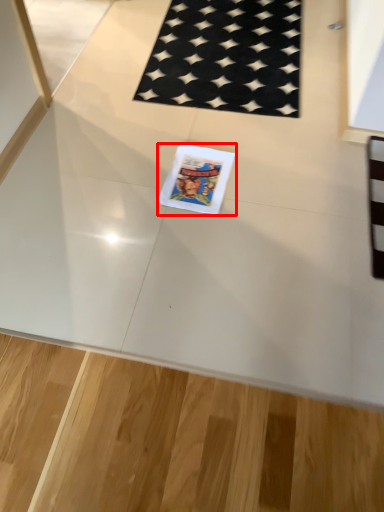
Question: Where is comic book (annotated by the red box) located in relation to mat in the image?

Choices:
 (A) right
 (B) left

Answer: (B)